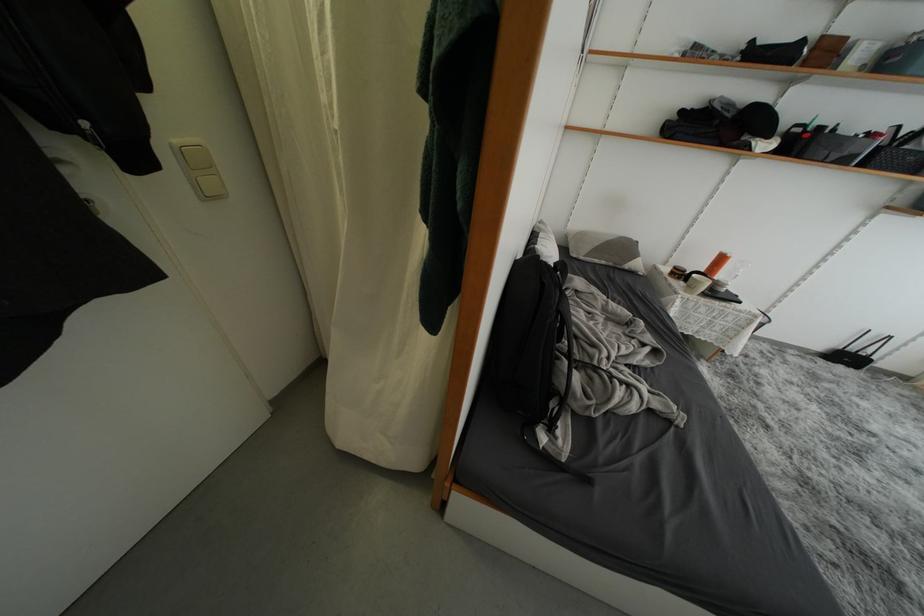
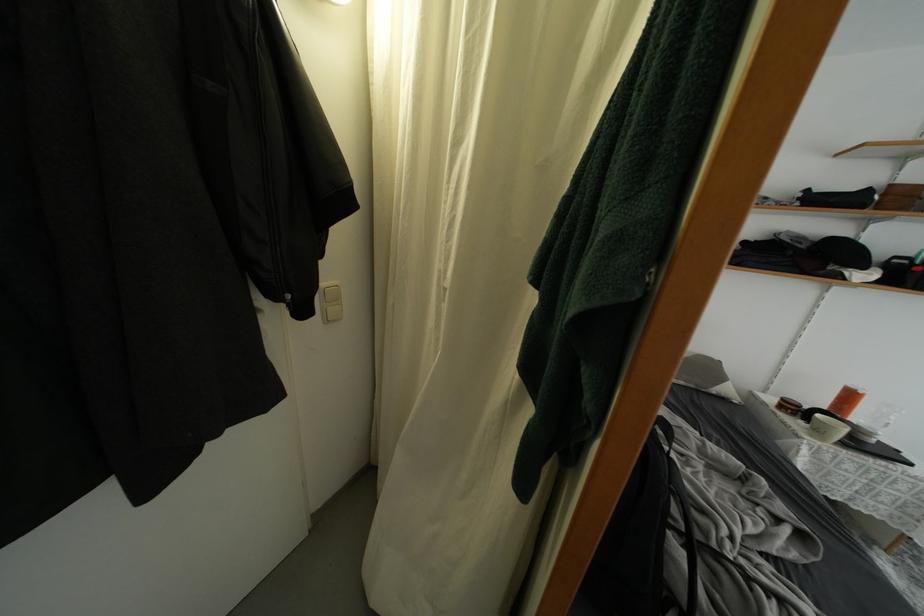
The point at (142,164) is marked in the first image. Where is the corresponding point in the second image?

(310, 315)